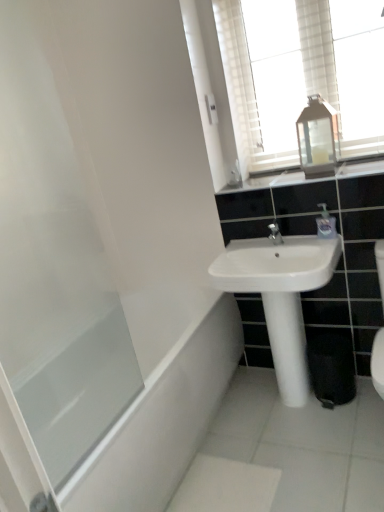
Question: Is transparent glass screen door at left far away from white ceramic sink at center?

Choices:
 (A) yes
 (B) no

Answer: (B)

Question: Is transparent glass screen door at left closer to camera compared to white ceramic sink at center?

Choices:
 (A) yes
 (B) no

Answer: (A)

Question: From the image's perspective, would you say transparent glass screen door at left is positioned over white ceramic sink at center?

Choices:
 (A) yes
 (B) no

Answer: (A)

Question: Considering the relative sizes of transparent glass screen door at left and white ceramic sink at center in the image provided, is transparent glass screen door at left taller than white ceramic sink at center?

Choices:
 (A) no
 (B) yes

Answer: (B)

Question: Is transparent glass screen door at left not within white ceramic sink at center?

Choices:
 (A) no
 (B) yes

Answer: (B)

Question: From a real-world perspective, relative to transparent glass bathtub at lower left, is white ceramic sink at center vertically above or below?

Choices:
 (A) above
 (B) below

Answer: (A)

Question: Would you say white ceramic sink at center is to the left or to the right of transparent glass bathtub at lower left in the picture?

Choices:
 (A) right
 (B) left

Answer: (A)

Question: Is white ceramic sink at center in front of or behind transparent glass bathtub at lower left in the image?

Choices:
 (A) behind
 (B) front

Answer: (A)

Question: Looking at the image, does white ceramic sink at center seem bigger or smaller compared to transparent glass bathtub at lower left?

Choices:
 (A) small
 (B) big

Answer: (A)

Question: From a real-world perspective, is transparent glass lantern at upper center positioned above or below transparent glass screen door at left?

Choices:
 (A) above
 (B) below

Answer: (A)

Question: Looking at the image, does transparent glass lantern at upper center seem bigger or smaller compared to transparent glass screen door at left?

Choices:
 (A) small
 (B) big

Answer: (A)

Question: Based on their positions, is transparent glass lantern at upper center located to the left or right of transparent glass screen door at left?

Choices:
 (A) left
 (B) right

Answer: (B)

Question: Choose the correct answer: Is transparent glass lantern at upper center inside transparent glass screen door at left or outside it?

Choices:
 (A) inside
 (B) outside

Answer: (B)

Question: In terms of height, does clear glass lantern at upper right look taller or shorter compared to transparent glass bathtub at lower left?

Choices:
 (A) tall
 (B) short

Answer: (A)

Question: In terms of width, does clear glass lantern at upper right look wider or thinner when compared to transparent glass bathtub at lower left?

Choices:
 (A) wide
 (B) thin

Answer: (B)